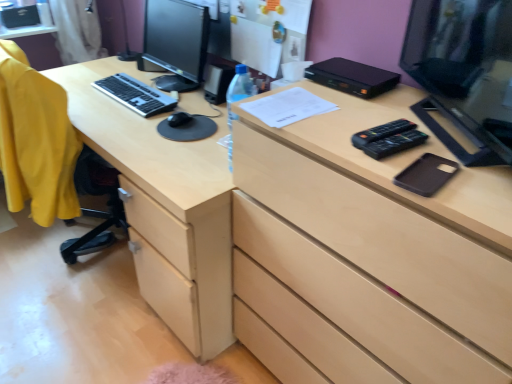
I want to click on free area in between black glossy monitor at upper right, the first computer monitor from the front, and black plastic printer at upper center, so click(x=387, y=115).